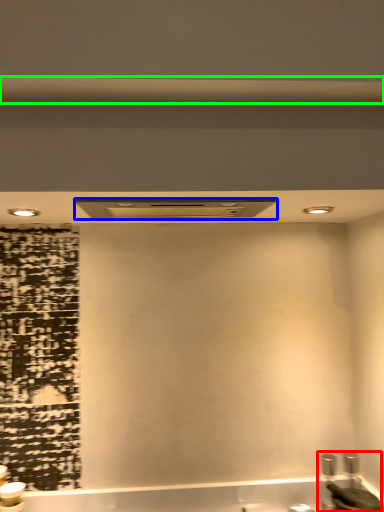
Question: Estimate the real-world distances between objects in this image. Which object is closer to sink (highlighted by a red box), exhaust hood (highlighted by a blue box) or beam (highlighted by a green box)?

Choices:
 (A) exhaust hood
 (B) beam

Answer: (A)